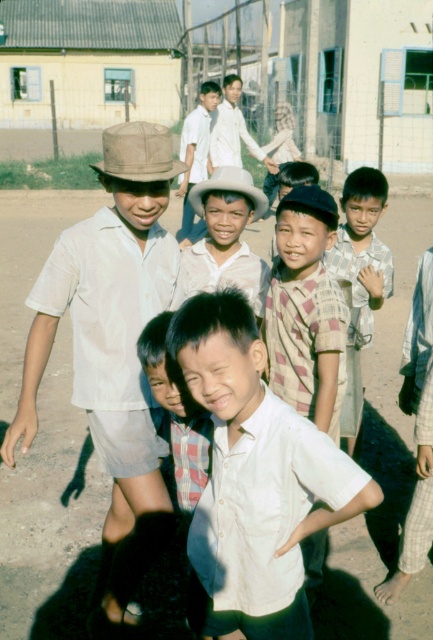
Question: Considering the real-world distances, which object is farthest from the matte brown hat at left?

Choices:
 (A) brown dirt field at center
 (B) matte white shirt at center
 (C) light brown cotton shirt at center
 (D) checkered fabric shirt at center

Answer: (A)

Question: Is matte white shirt at center to the right of light brown cotton shirt at center from the viewer's perspective?

Choices:
 (A) yes
 (B) no

Answer: (A)

Question: Which point is closer to the camera?

Choices:
 (A) (181, 189)
 (B) (319, 193)

Answer: (B)

Question: Is brown dirt field at center thinner than matte white shirt at center?

Choices:
 (A) no
 (B) yes

Answer: (A)

Question: Which object is farther from the camera taking this photo?

Choices:
 (A) white cotton shirt at center
 (B) brown dirt field at center
 (C) matte white shirt at center
 (D) plaid cotton shirt at center

Answer: (B)

Question: Can you confirm if white cotton shirt at center is positioned to the right of matte white shirt at center?

Choices:
 (A) yes
 (B) no

Answer: (A)